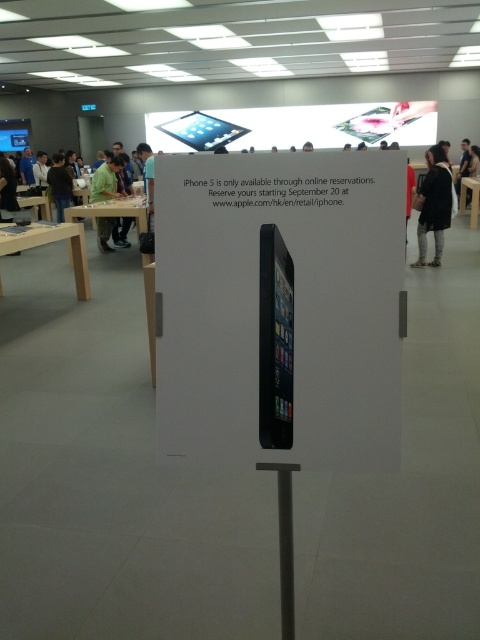
Question: Which object appears closest to the camera in this image?

Choices:
 (A) black fabric at upper right
 (B) dark brown leather jacket at upper left

Answer: (A)

Question: Which object appears farthest from the camera in this image?

Choices:
 (A) black fabric at upper right
 (B) green fabric shirt at center
 (C) dark brown leather jacket at upper left

Answer: (C)

Question: Among these objects, which one is farthest from the camera?

Choices:
 (A) green fabric shirt at center
 (B) dark brown leather jacket at upper left
 (C) black fabric at upper right

Answer: (B)

Question: Can you confirm if green fabric shirt at center is smaller than dark brown leather jacket at upper left?

Choices:
 (A) yes
 (B) no

Answer: (A)

Question: Can you confirm if black fabric at upper right is smaller than dark brown leather jacket at upper left?

Choices:
 (A) yes
 (B) no

Answer: (A)

Question: Is green fabric shirt at center in front of dark brown leather jacket at upper left?

Choices:
 (A) no
 (B) yes

Answer: (B)